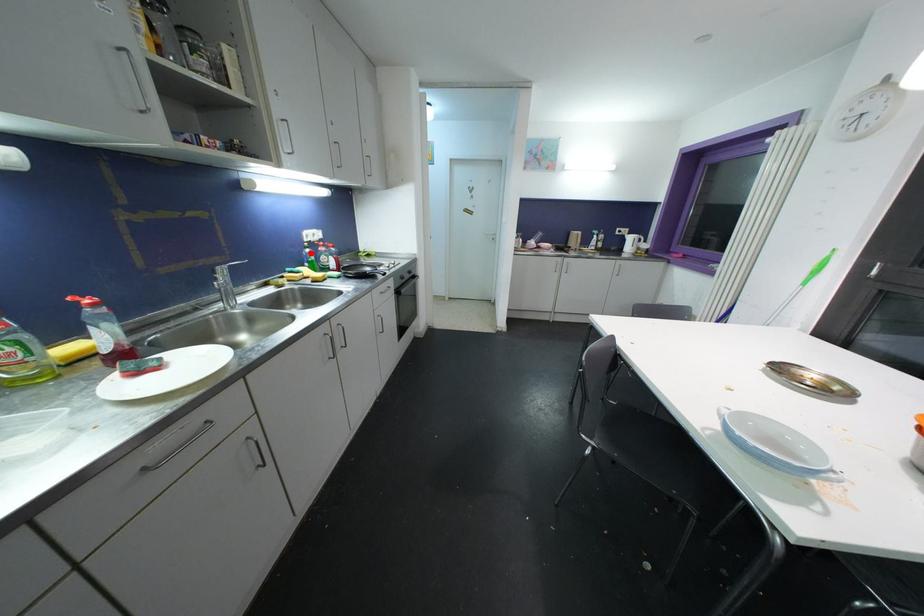
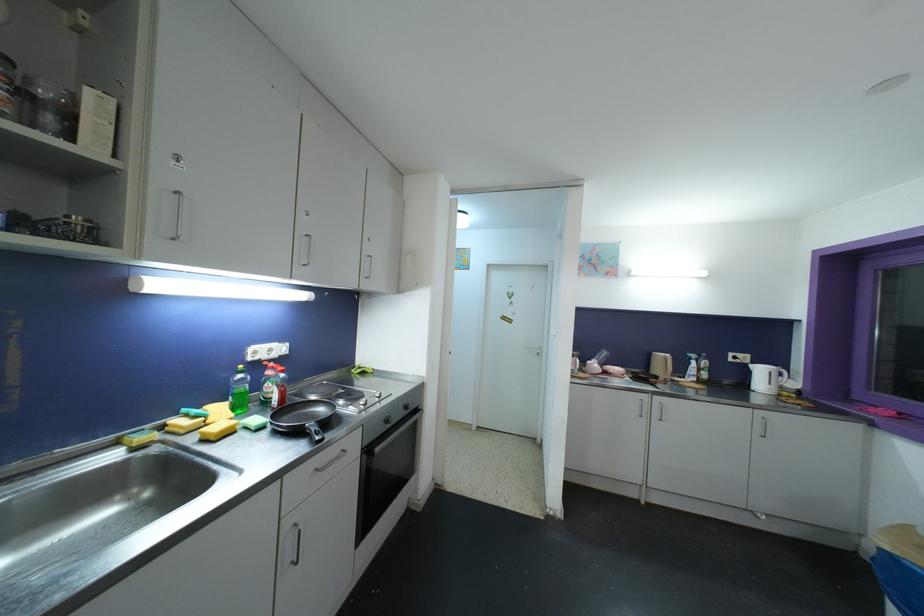
Question: I am providing you with two images of the same scene from different viewpoints. In image1, a red point is highlighted. Considering the same 3D point in image2, which of the following is correct?

Choices:
 (A) It is closer
 (B) It is farther

Answer: (B)